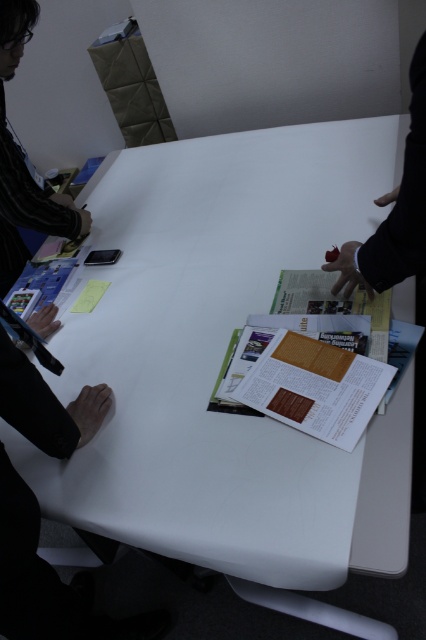
Can you confirm if white glossy paper at center is positioned to the left of black fabric hand at right?

Correct, you'll find white glossy paper at center to the left of black fabric hand at right.

What do you see at coordinates (314, 387) in the screenshot? I see `white glossy paper at center` at bounding box center [314, 387].

Where is `white glossy paper at center`? This screenshot has height=640, width=426. white glossy paper at center is located at coordinates (314, 387).

Can you confirm if black fabric hand at right is positioned below striped shirt at left?

Indeed, black fabric hand at right is positioned under striped shirt at left.

Between point (370, 291) and point (31, 28), which one is positioned behind?

Point (31, 28)

This screenshot has width=426, height=640. In order to click on black fabric hand at right in this screenshot , I will do click(394, 211).

Does white glossy paper at center appear over striped shirt at left?

Actually, white glossy paper at center is below striped shirt at left.

Who is positioned more to the right, white glossy paper at center or striped shirt at left?

white glossy paper at center

Between point (336, 436) and point (13, 22), which one is positioned behind?

Point (13, 22)

Locate an element on the screen. The height and width of the screenshot is (640, 426). white glossy paper at center is located at coordinates (314, 387).